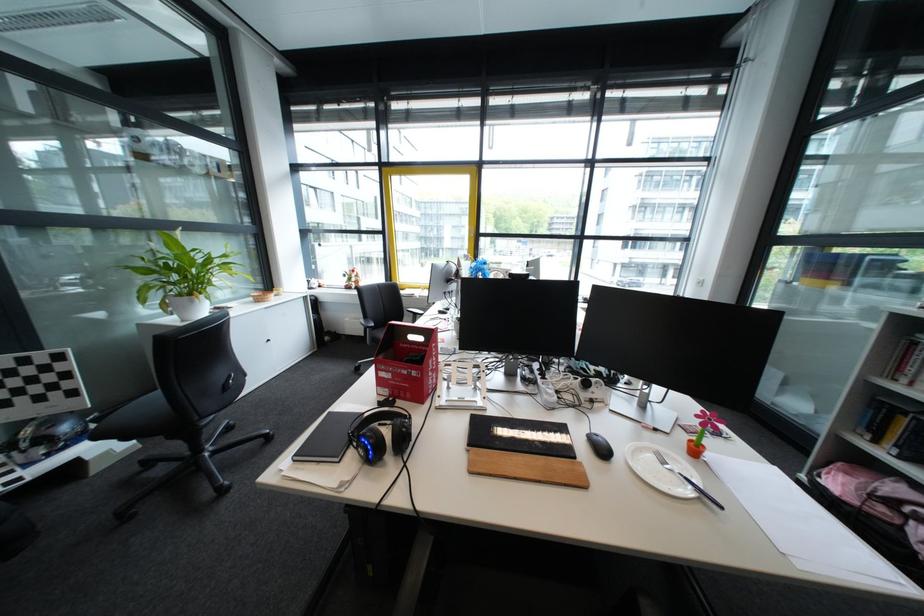
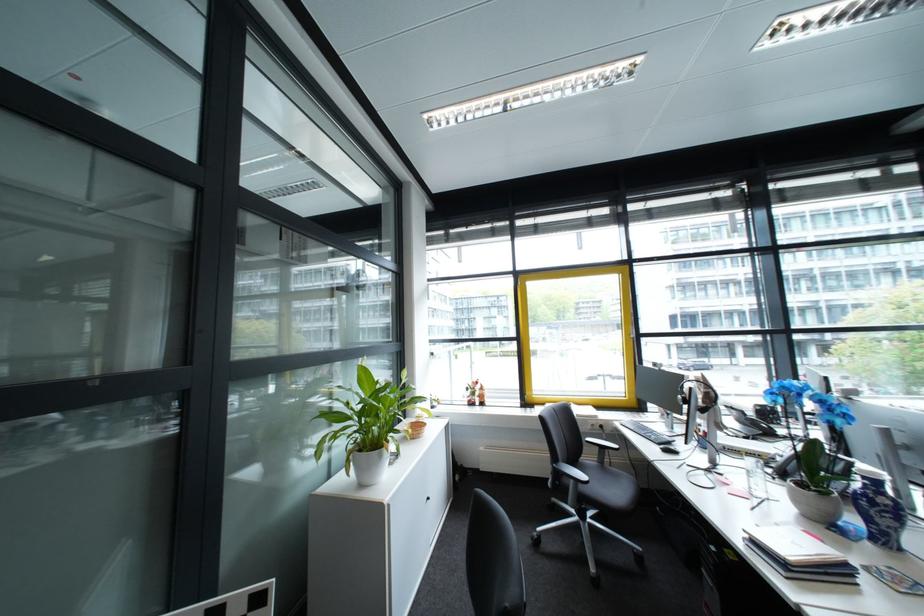
Question: Which direction would the cameraman need to move to produce the second image? Reply with the corresponding letter.

Choices:
 (A) Left
 (B) Right
 (C) Forward
 (D) Backward

Answer: (A)